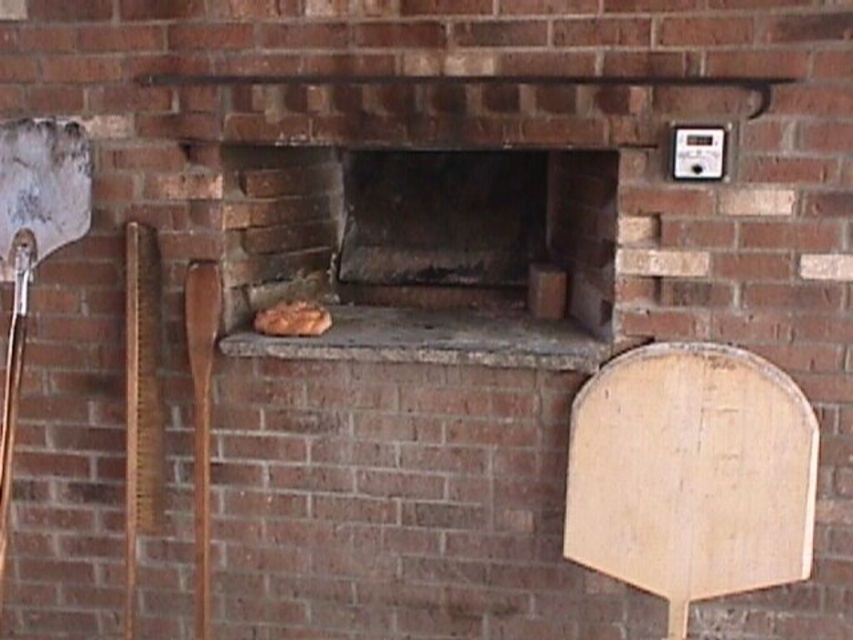
Between point (6, 461) and point (285, 326), which one is positioned in front?

Point (6, 461)

You are a GUI agent. You are given a task and a screenshot of the screen. Output one action in this format:
    pyautogui.click(x=<x>, y=<y>)
    Task: Click on the silver metallic shovel at left
    
    Given the screenshot: What is the action you would take?
    pyautogui.click(x=33, y=243)

Looking at this image, who is positioned more to the left, silver metallic shovel at left or wooden spatula at center?

silver metallic shovel at left is more to the left.

The height and width of the screenshot is (640, 853). I want to click on silver metallic shovel at left, so click(33, 243).

Measure the distance from wooden spatula at center to golden brown crusty bread at center.

9.53 inches

Find the location of `wooden spatula at center`. wooden spatula at center is located at coordinates (201, 413).

Image resolution: width=853 pixels, height=640 pixels. I want to click on wooden spatula at center, so click(201, 413).